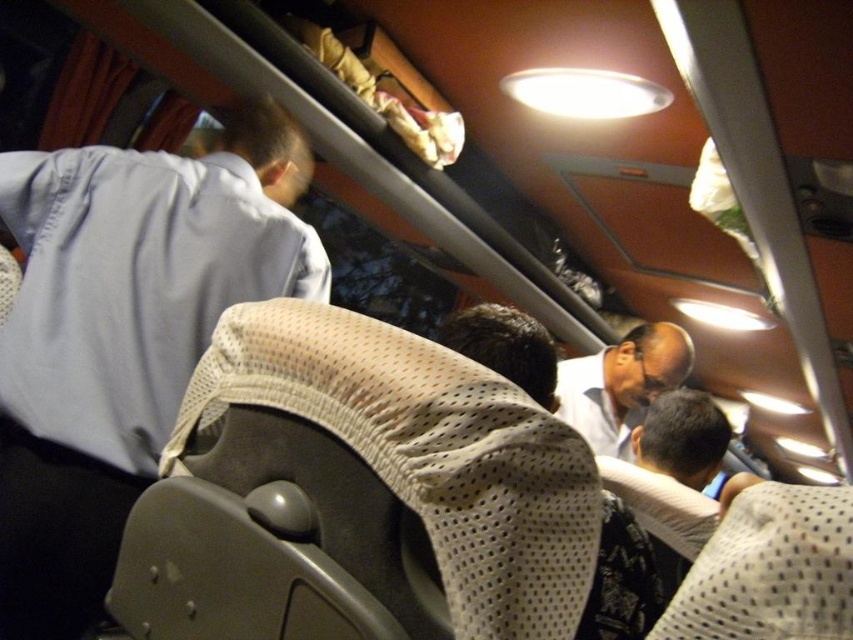
You are a passenger on a train or bus and need to find the light blue fabric shirt at upper left. Based on the coordinates provided, can you determine if it is closer to the front or the back of the vehicle?

The light blue fabric shirt at upper left is located at point 0.523 on the x and y axis, which places it closer to the front of the vehicle since lower coordinates typically indicate proximity to the front in such systems.